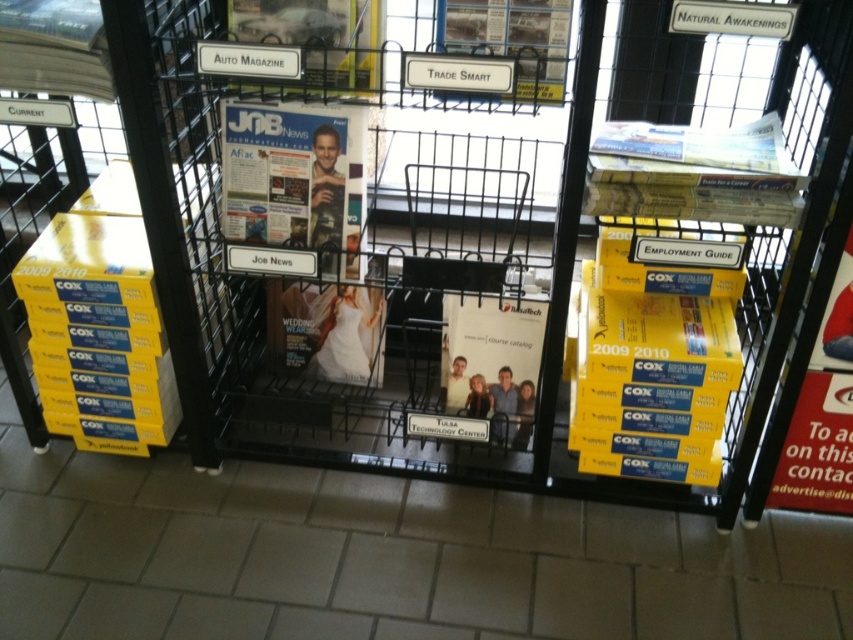
Consider the image. Between matte paper magazine at center and white paper at center, which one has more height?

matte paper magazine at center is taller.

Who is more forward, (x=228, y=230) or (x=503, y=419)?

Point (x=228, y=230)

The height and width of the screenshot is (640, 853). Identify the location of matte paper magazine at center. (294, 179).